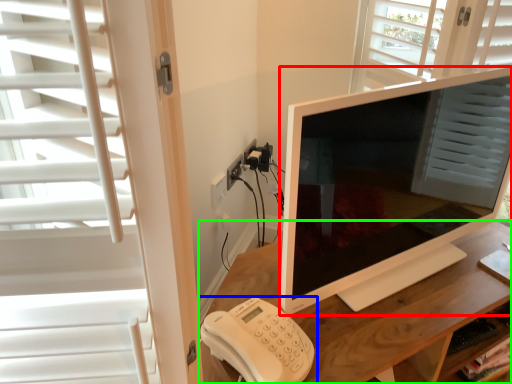
Question: Which object is the closest to the television (highlighted by a red box)? Choose among these: corded phone (highlighted by a blue box) or desk (highlighted by a green box).

Choices:
 (A) corded phone
 (B) desk

Answer: (B)